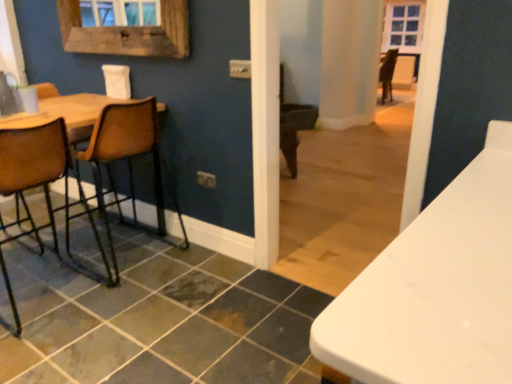
In order to click on free point to the right of brown leather chair at left, which is the 2th chair from left to right in this screenshot , I will do `click(199, 275)`.